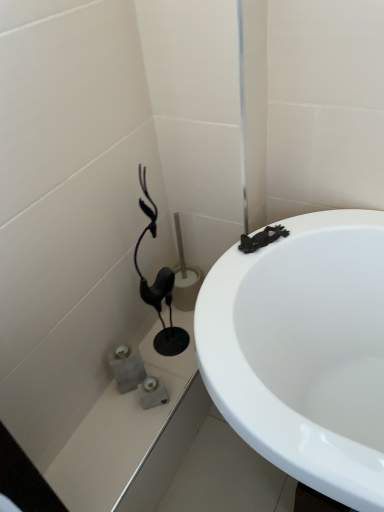
Where is `free space in front of black matte toilet brush at lower left`? The image size is (384, 512). free space in front of black matte toilet brush at lower left is located at coordinates pos(159,384).